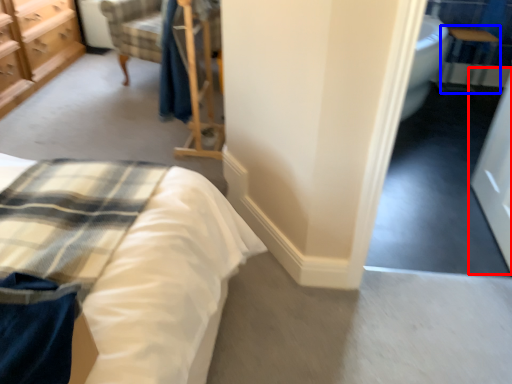
Question: Among these objects, which one is nearest to the camera, screen door (highlighted by a red box) or table (highlighted by a blue box)?

Choices:
 (A) screen door
 (B) table

Answer: (A)